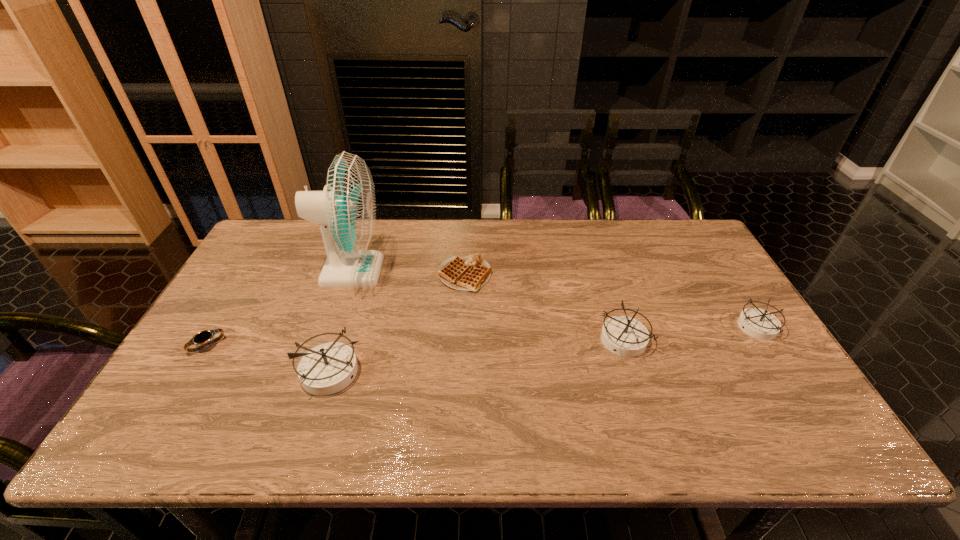
You are a GUI agent. You are given a task and a screenshot of the screen. Output one action in this format:
    pyautogui.click(x=<x>, y=<y>)
    Task: Click on the blank area in the image that satisfies the following two spatial constraints: 1. on the front side of the third tallest object; 2. on the right side of the waffle
    Image resolution: width=960 pixels, height=540 pixels.
    Given the screenshot: What is the action you would take?
    pyautogui.click(x=463, y=341)

Image resolution: width=960 pixels, height=540 pixels. In order to click on vacant region that satisfies the following two spatial constraints: 1. on the back side of the rightmost compass; 2. on the right side of the second shortest compass in this screenshot , I will do `click(620, 327)`.

Image resolution: width=960 pixels, height=540 pixels. I want to click on free location that satisfies the following two spatial constraints: 1. on the front side of the leftmost compass; 2. on the left side of the leftmost object, so click(x=193, y=370).

Identify the location of vacant space that satisfies the following two spatial constraints: 1. in front of the rightmost compass to face the airflow; 2. on the right side of the tallest object. The image size is (960, 540). (332, 327).